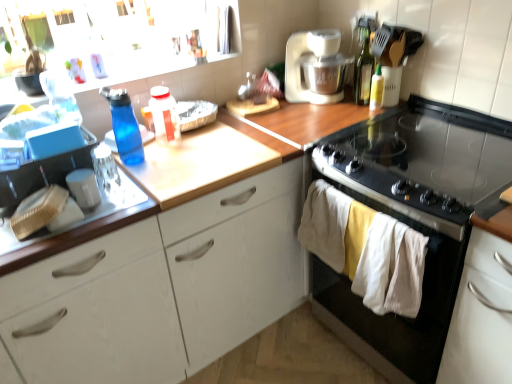
Identify the location of free space on the front side of white plastic mixer at upper right. This screenshot has height=384, width=512. (318, 118).